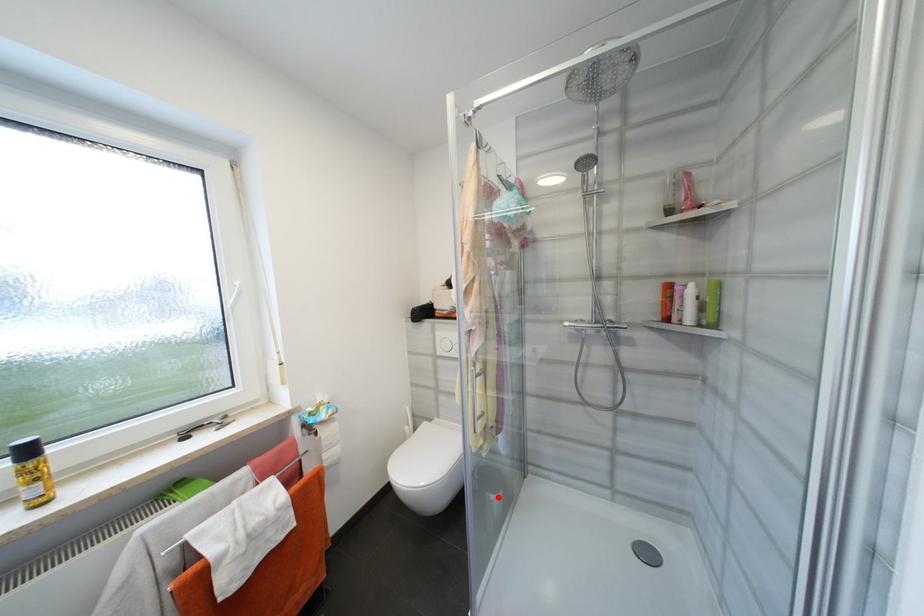
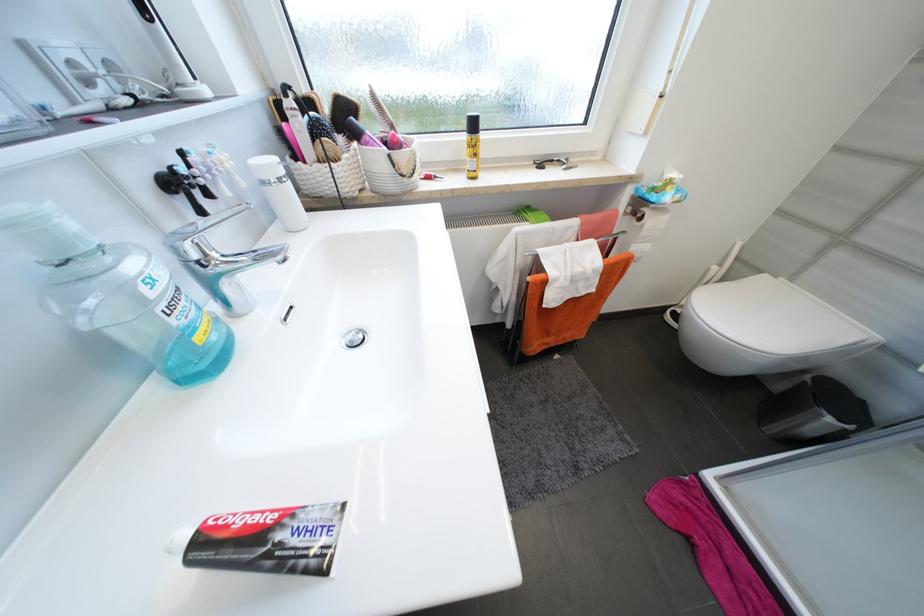
Find the pixel in the second image that matches the highlighted location in the first image.

(834, 421)